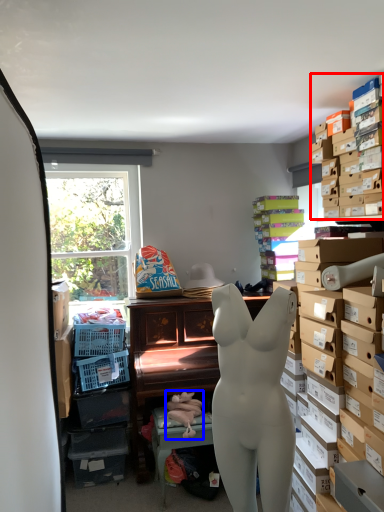
Question: Which object is further to the camera taking this photo, shelf (highlighted by a red box) or toy (highlighted by a blue box)?

Choices:
 (A) shelf
 (B) toy

Answer: (B)